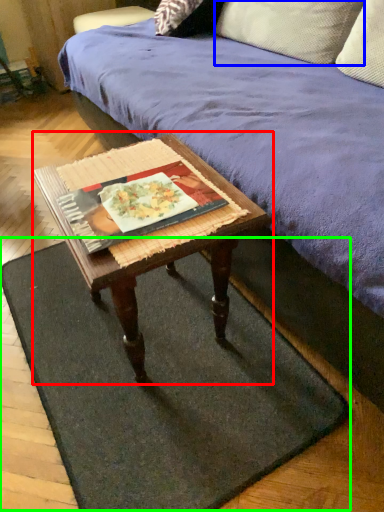
Question: Based on their relative distances, which object is farther from coffee table (highlighted by a red box)? Choose from pillow (highlighted by a blue box) and doormat (highlighted by a green box).

Choices:
 (A) pillow
 (B) doormat

Answer: (A)